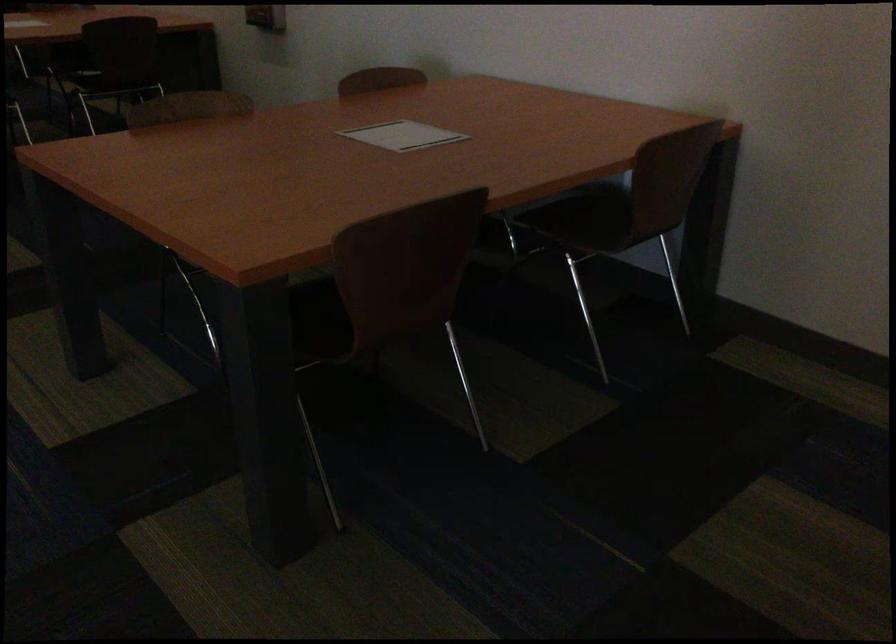
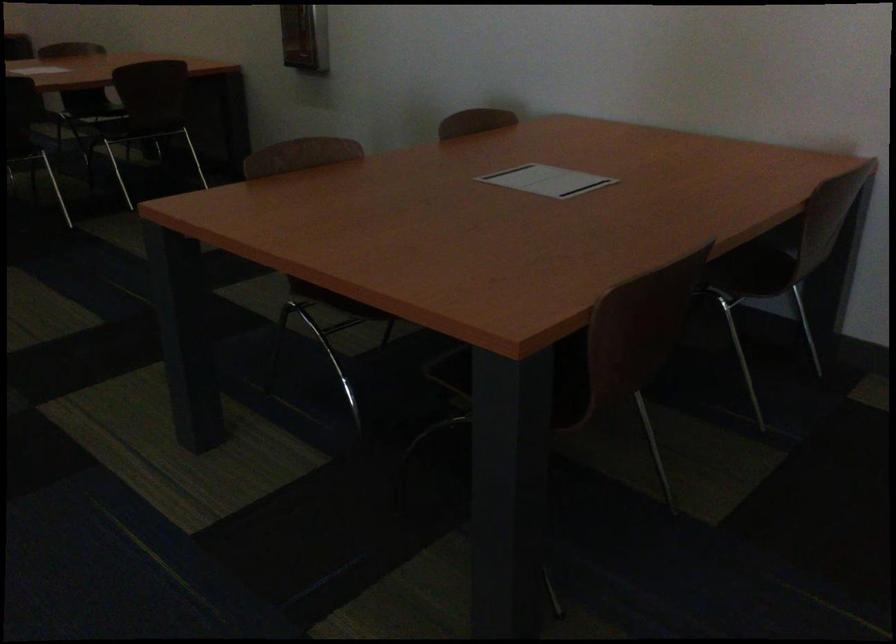
Question: The first image is from the beginning of the video and the second image is from the end. How did the camera likely rotate when shooting the video?

Choices:
 (A) Left
 (B) Right
 (C) Up
 (D) Down

Answer: (B)